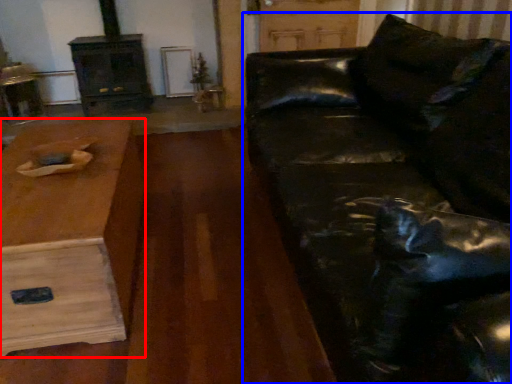
Question: Which of the following is the farthest to the observer, table (highlighted by a red box) or studio couch (highlighted by a blue box)?

Choices:
 (A) table
 (B) studio couch

Answer: (A)